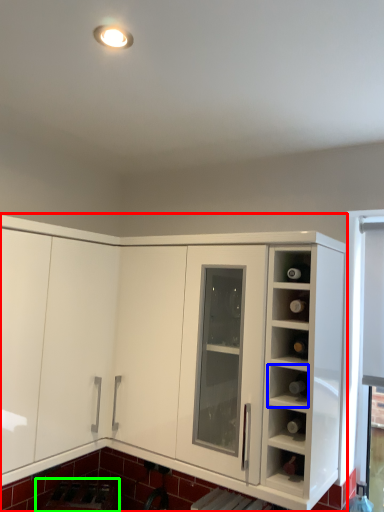
Question: Which object is the closest to the cabinetry (highlighted by a red box)? Choose among these: shelf (highlighted by a blue box) or appliance (highlighted by a green box).

Choices:
 (A) shelf
 (B) appliance

Answer: (A)